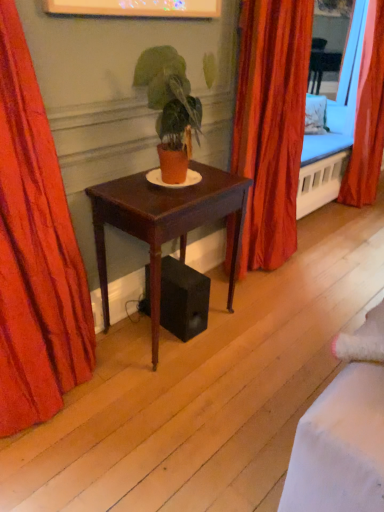
You are a GUI agent. You are given a task and a screenshot of the screen. Output one action in this format:
    pyautogui.click(x=<x>, y=<y>)
    Task: Click on the free space that is in between silky orange curtain at center, which ranks as the second curtain in right-to-left order, and mahogany wood desk at center
    Image resolution: width=384 pixels, height=512 pixels.
    Given the screenshot: What is the action you would take?
    pyautogui.click(x=240, y=290)